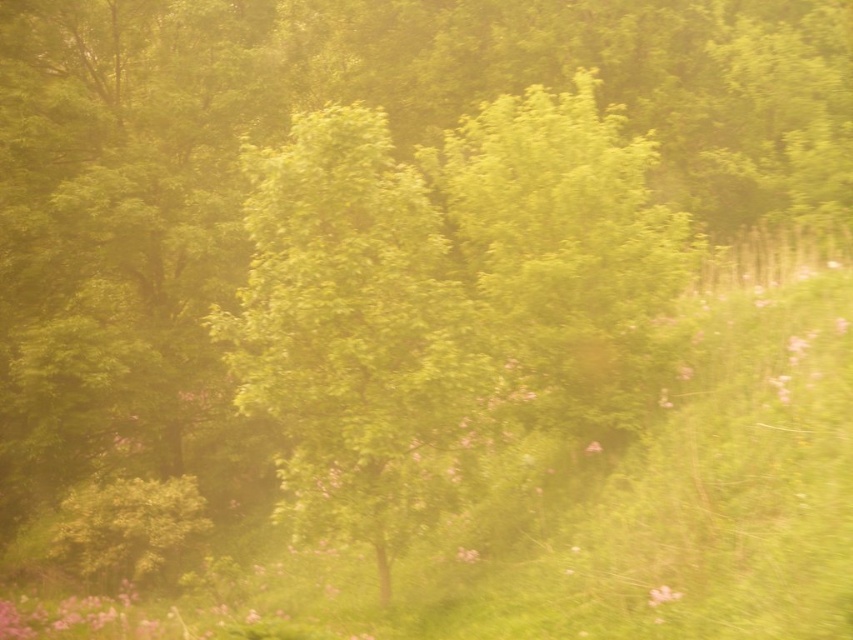
Question: Can you confirm if green leafy tree at center is wider than soft pink petals at center?

Choices:
 (A) no
 (B) yes

Answer: (B)

Question: Is green leafy tree at center above soft pink petals at center?

Choices:
 (A) yes
 (B) no

Answer: (A)

Question: Where is green leafy tree at center located in relation to soft pink petals at center in the image?

Choices:
 (A) below
 (B) above

Answer: (B)

Question: Which point is farther to the camera?

Choices:
 (A) (659, 588)
 (B) (281, 416)

Answer: (B)

Question: Which of the following is the closest to the observer?

Choices:
 (A) soft pink petals at center
 (B) green leafy tree at center

Answer: (A)